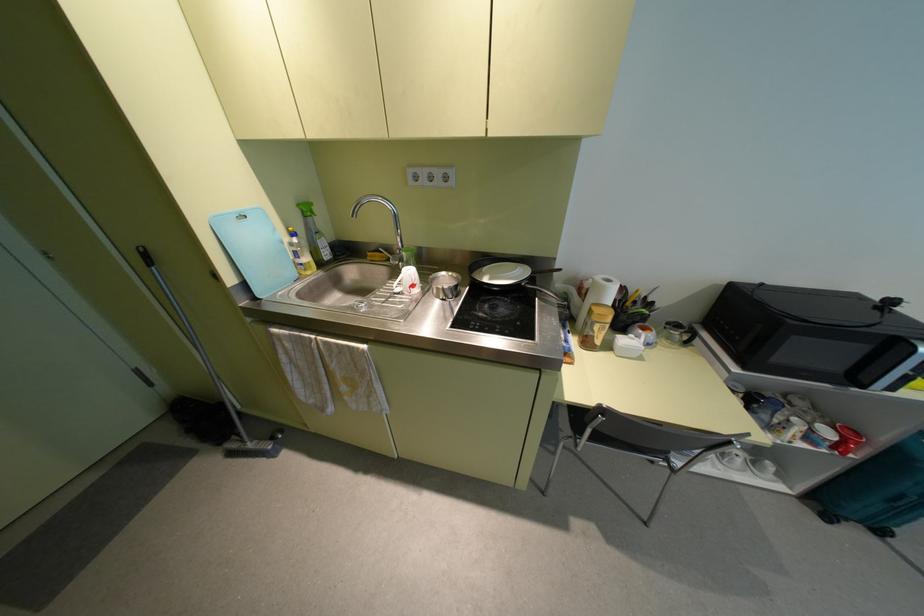
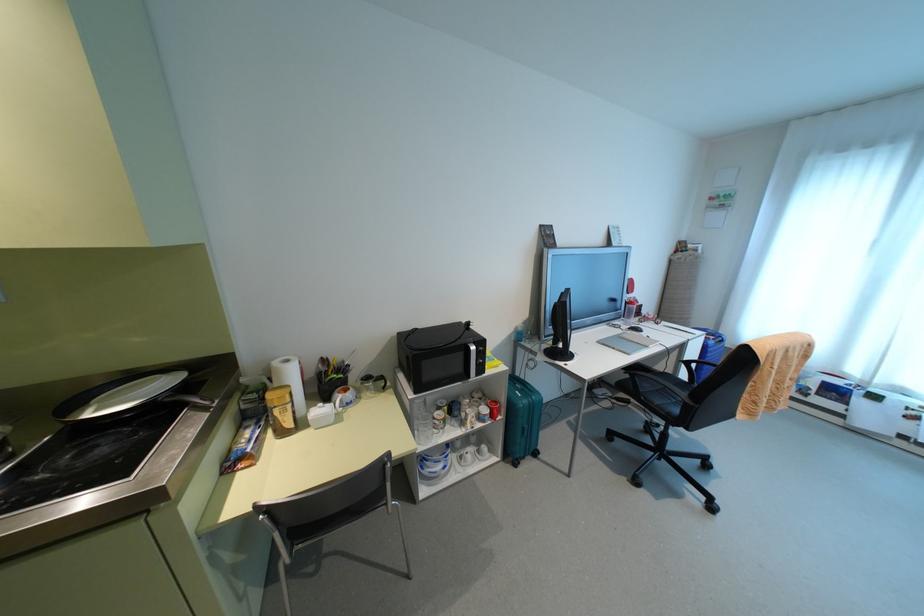
Where in the second image is the point corresponding to pixel 721 453 from the first image?

(459, 456)